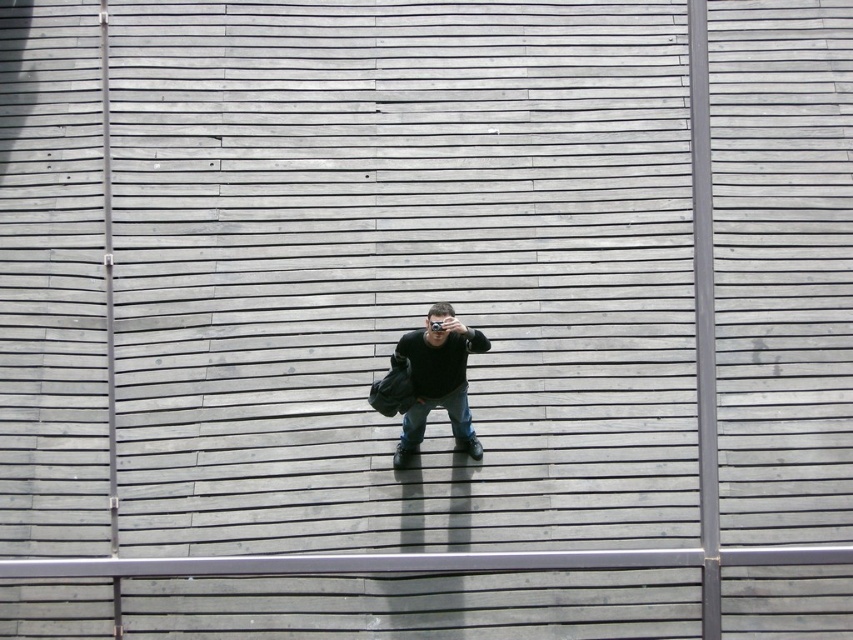
Question: Which of the following is the farthest from the observer?

Choices:
 (A) click(x=412, y=355)
 (B) click(x=405, y=444)

Answer: (B)

Question: Which of the following is the farthest from the observer?

Choices:
 (A) (457, 387)
 (B) (453, 364)

Answer: (A)

Question: Is matte black camera at center to the right of denim jeans at center from the viewer's perspective?

Choices:
 (A) no
 (B) yes

Answer: (A)

Question: Observing the image, what is the correct spatial positioning of matte black camera at center in reference to denim jeans at center?

Choices:
 (A) right
 (B) left

Answer: (B)

Question: Among these objects, which one is farthest from the camera?

Choices:
 (A) matte black camera at center
 (B) denim jeans at center

Answer: (B)

Question: Does matte black camera at center have a larger size compared to denim jeans at center?

Choices:
 (A) no
 (B) yes

Answer: (B)